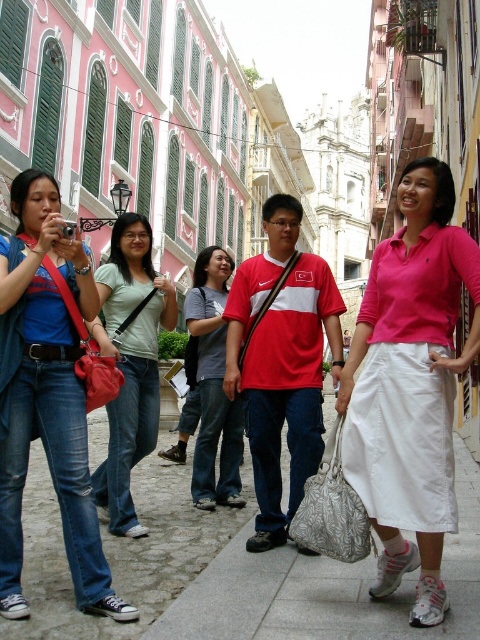
Which of these two, white tile pavement at lower center or matte red purse at left, stands taller?

white tile pavement at lower center

Between point (199, 602) and point (112, 371), which one is positioned behind?

The point (112, 371) is more distant.

Locate an element on the screen. white tile pavement at lower center is located at coordinates (325, 588).

You are a GUI agent. You are given a task and a screenshot of the screen. Output one action in this format:
    pyautogui.click(x=<x>, y=<y>)
    Task: Click on the white tile pavement at lower center
    
    Given the screenshot: What is the action you would take?
    pyautogui.click(x=325, y=588)

Between point (386, 552) and point (120, 429), which one is positioned behind?

Point (120, 429)

Who is lower down, pink cotton polo shirt at center or light green cotton shirt at center?

light green cotton shirt at center is below.

Is point (410, 433) positioned before point (145, 221)?

Yes, point (410, 433) is closer to viewer.

In order to click on pink cotton polo shirt at center in this screenshot , I will do `click(410, 385)`.

From the picture: Does pink cotton polo shirt at center have a lesser height compared to silver textured handbag at center?

No.

Is pink cotton polo shirt at center above silver textured handbag at center?

Yes.

Is point (407, 404) more distant than point (359, 545)?

Yes.

This screenshot has height=640, width=480. I want to click on pink cotton polo shirt at center, so click(410, 385).